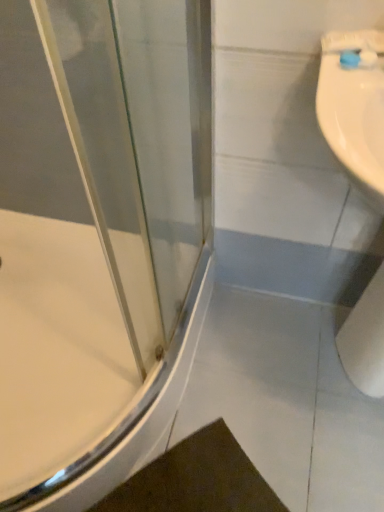
What do you see at coordinates (56, 349) in the screenshot?
I see `white glossy bathtub at left` at bounding box center [56, 349].

Describe the element at coordinates (365, 339) in the screenshot. I see `white matte toilet paper at lower right` at that location.

In order to face blue plastic toothbrush at upper right, should I rotate leftwards or rightwards?

To face it directly, rotate right by 20.640 degrees.

This screenshot has width=384, height=512. Describe the element at coordinates (358, 59) in the screenshot. I see `blue plastic toothbrush at upper right` at that location.

Where is `white glossy bathtub at left`? This screenshot has width=384, height=512. white glossy bathtub at left is located at coordinates (56, 349).

Which is in front, point (9, 314) or point (383, 370)?

The point (383, 370) is closer to the camera.

Considering the relative positions of white glossy bathtub at left and white matte toilet paper at lower right in the image provided, is white glossy bathtub at left to the left of white matte toilet paper at lower right from the viewer's perspective?

Indeed, white glossy bathtub at left is positioned on the left side of white matte toilet paper at lower right.

Is white glossy bathtub at left oriented towards white matte toilet paper at lower right?

No, white glossy bathtub at left is not facing towards white matte toilet paper at lower right.

Considering the positions of objects blue plastic toothbrush at upper right and white glossy bathtub at left in the image provided, who is more to the right, blue plastic toothbrush at upper right or white glossy bathtub at left?

blue plastic toothbrush at upper right.

Who is bigger, blue plastic toothbrush at upper right or white glossy bathtub at left?

With larger size is white glossy bathtub at left.

Which point is more distant from viewer, (x=345, y=60) or (x=4, y=434)?

The point (x=4, y=434) is more distant.

At what (x,y) coordinates should I click in order to perform the action: click on bath lying below the blue plastic toothbrush at upper right (from the image's perspective). Please return your answer as a coordinate pair (x, y). The height and width of the screenshot is (512, 384). Looking at the image, I should click on (56, 349).

Between white glossy bathtub at left and blue plastic toothbrush at upper right, which one has less height?

blue plastic toothbrush at upper right.

Locate an element on the screen. bath on the left of the blue plastic toothbrush at upper right is located at coordinates (x=56, y=349).

Looking at the image, does white glossy bathtub at left seem bigger or smaller compared to blue plastic toothbrush at upper right?

Clearly, white glossy bathtub at left is larger in size than blue plastic toothbrush at upper right.

Is white glossy bathtub at left far away from blue plastic toothbrush at upper right?

white glossy bathtub at left is actually quite close to blue plastic toothbrush at upper right.

Does blue plastic toothbrush at upper right have a smaller size compared to white matte toilet paper at lower right?

Yes, blue plastic toothbrush at upper right is smaller than white matte toilet paper at lower right.

Is blue plastic toothbrush at upper right not inside white matte toilet paper at lower right?

Yes, blue plastic toothbrush at upper right is not within white matte toilet paper at lower right.

Considering the points (348, 62) and (380, 346), which point is in front, point (348, 62) or point (380, 346)?

The point (348, 62) is more forward.

What's the angular difference between blue plastic toothbrush at upper right and white matte toilet paper at lower right's facing directions?

There is a 24.6-degree angle between the facing directions of blue plastic toothbrush at upper right and white matte toilet paper at lower right.

Is white glossy bathtub at left surrounded by white matte toilet paper at lower right?

Definitely not — white glossy bathtub at left is not inside white matte toilet paper at lower right.

Looking at this image, is white matte toilet paper at lower right positioned with its back to white glossy bathtub at left?

No, white matte toilet paper at lower right is not facing away from white glossy bathtub at left.

This screenshot has height=512, width=384. I want to click on bath below the white matte toilet paper at lower right (from a real-world perspective), so click(x=56, y=349).

Would you say white matte toilet paper at lower right is outside blue plastic toothbrush at upper right?

Indeed, white matte toilet paper at lower right is completely outside blue plastic toothbrush at upper right.

From a real-world perspective, does white matte toilet paper at lower right sit lower than blue plastic toothbrush at upper right?

Yes, from a real-world perspective, white matte toilet paper at lower right is below blue plastic toothbrush at upper right.

From the image's perspective, is white matte toilet paper at lower right positioned above or below blue plastic toothbrush at upper right?

Clearly, from the image's perspective, white matte toilet paper at lower right is below blue plastic toothbrush at upper right.

Where is `bath behind the white matte toilet paper at lower right`? The height and width of the screenshot is (512, 384). bath behind the white matte toilet paper at lower right is located at coordinates (56, 349).

This screenshot has width=384, height=512. I want to click on bath below the blue plastic toothbrush at upper right (from the image's perspective), so click(x=56, y=349).

Looking at this image, considering their positions, is white glossy bathtub at left positioned further to white matte toilet paper at lower right than blue plastic toothbrush at upper right?

The object further to white matte toilet paper at lower right is white glossy bathtub at left.

When comparing their distances from white matte toilet paper at lower right, does blue plastic toothbrush at upper right or white glossy bathtub at left seem further?

white glossy bathtub at left lies further to white matte toilet paper at lower right than the other object.

Based on their spatial positions, is white matte toilet paper at lower right or white glossy bathtub at left closer to blue plastic toothbrush at upper right?

Based on the image, white matte toilet paper at lower right appears to be nearer to blue plastic toothbrush at upper right.

Looking at the image, which one is located closer to blue plastic toothbrush at upper right, white glossy bathtub at left or white matte toilet paper at lower right?

Based on the image, white matte toilet paper at lower right appears to be nearer to blue plastic toothbrush at upper right.

Based on the photo, based on their spatial positions, is blue plastic toothbrush at upper right or white matte toilet paper at lower right further from white glossy bathtub at left?

blue plastic toothbrush at upper right is positioned further to the anchor white glossy bathtub at left.

Considering their positions, is white matte toilet paper at lower right positioned closer to white glossy bathtub at left than blue plastic toothbrush at upper right?

The object closer to white glossy bathtub at left is white matte toilet paper at lower right.

Where is `toothbrush between white glossy bathtub at left and white matte toilet paper at lower right`? The width and height of the screenshot is (384, 512). toothbrush between white glossy bathtub at left and white matte toilet paper at lower right is located at coordinates point(358,59).